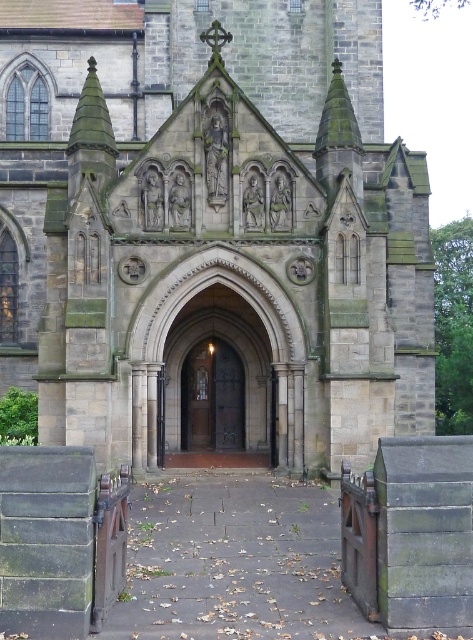
Question: Is dark gray stone church at center to the right of brown wooden door at center from the viewer's perspective?

Choices:
 (A) yes
 (B) no

Answer: (B)

Question: Which point is closer to the camera taking this photo?

Choices:
 (A) (78, 305)
 (B) (194, 392)

Answer: (A)

Question: From the image, what is the correct spatial relationship of dark gray stone church at center in relation to brown wooden door at center?

Choices:
 (A) left
 (B) right

Answer: (A)

Question: Which point is farther from the camera taking this photo?

Choices:
 (A) (192, 372)
 (B) (125, 173)

Answer: (A)

Question: From the image, what is the correct spatial relationship of dark gray stone church at center in relation to brown wooden door at center?

Choices:
 (A) above
 (B) below

Answer: (A)